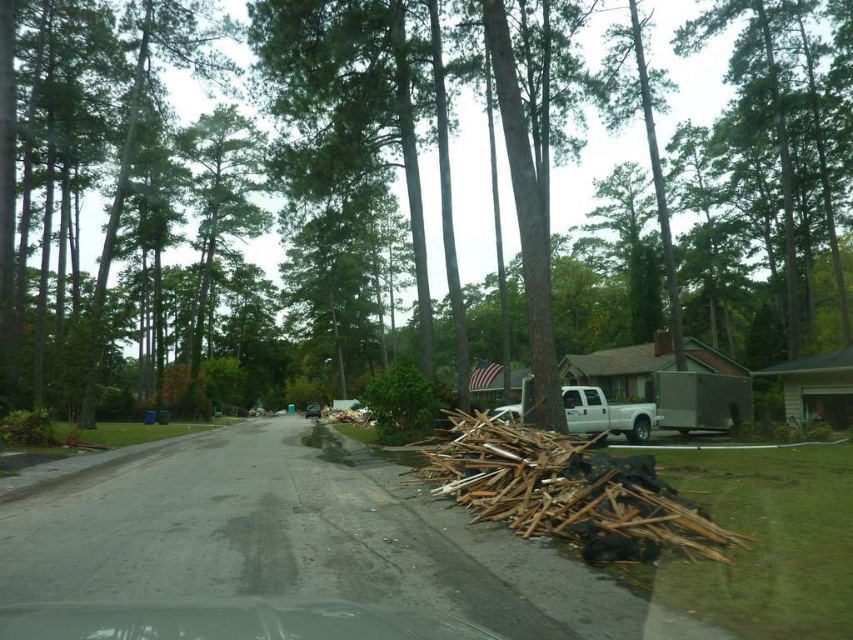
Between brown wood tree at center and brown wood debris at lower right, which one is positioned lower?

brown wood debris at lower right is lower down.

Identify the location of brown wood tree at center. (216, 195).

In the scene shown: Which of these two, brown wood tree at center or metallic silver car at center, stands shorter?

Standing shorter between the two is metallic silver car at center.

Is point (338, 243) behind point (315, 404)?

No, it is not.

Where is `brown wood tree at center`? This screenshot has height=640, width=853. brown wood tree at center is located at coordinates click(x=216, y=195).

The height and width of the screenshot is (640, 853). What do you see at coordinates (566, 490) in the screenshot?
I see `brown wood debris at lower right` at bounding box center [566, 490].

Can you confirm if brown wood debris at lower right is wider than metallic silver trailer at right?

Indeed, brown wood debris at lower right has a greater width compared to metallic silver trailer at right.

Between point (553, 470) and point (656, 394), which one is positioned behind?

The point (656, 394) is behind.

Where is `brown wood debris at lower right`? brown wood debris at lower right is located at coordinates pyautogui.click(x=566, y=490).